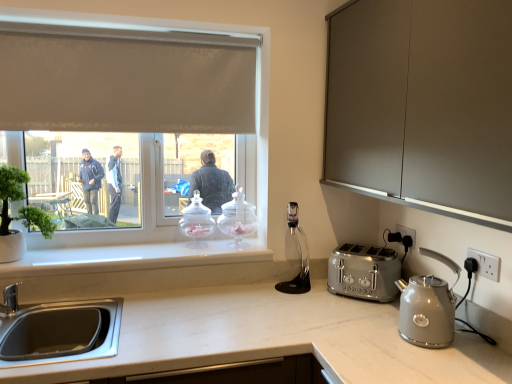
Identify the location of free region on the left part of clear glass jar at window, arranged as the 3th kitchen appliance when viewed from the right. (155, 251).